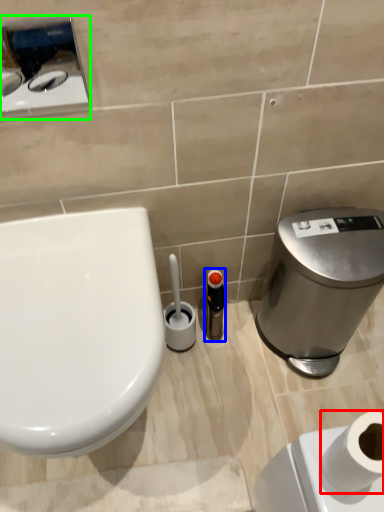
Question: Which is farther away from toilet paper (highlighted by a red box)? toiletry (highlighted by a blue box) or appliance (highlighted by a green box)?

Choices:
 (A) toiletry
 (B) appliance

Answer: (B)